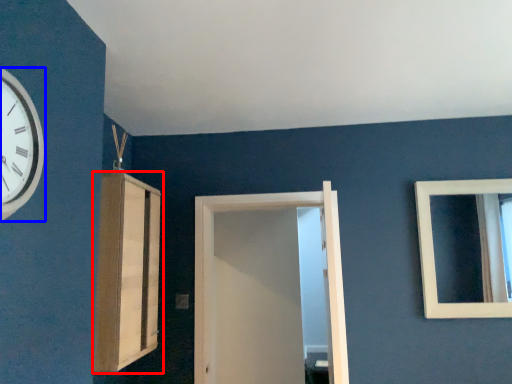
Question: Among these objects, which one is farthest to the camera, cabinetry (highlighted by a red box) or wall clock (highlighted by a blue box)?

Choices:
 (A) cabinetry
 (B) wall clock

Answer: (A)